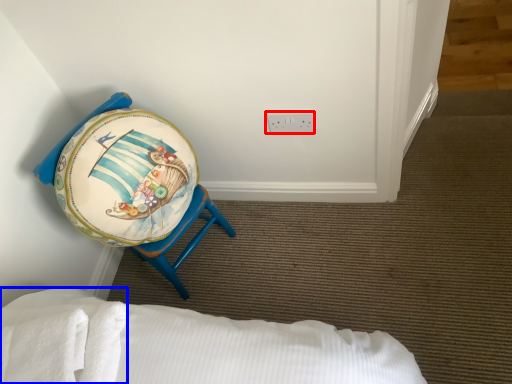
Question: Among these objects, which one is nearest to the camera, electric outlet (highlighted by a red box) or sheet (highlighted by a blue box)?

Choices:
 (A) electric outlet
 (B) sheet

Answer: (B)